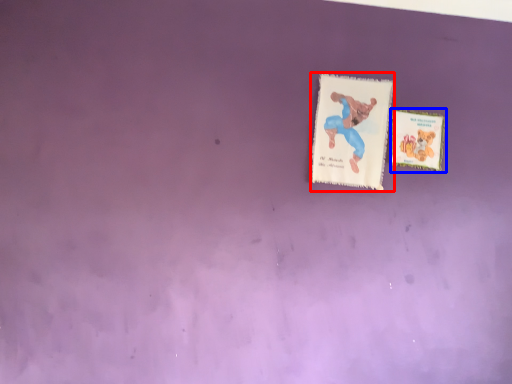
Question: Among these objects, which one is farthest to the camera, card (highlighted by a red box) or card (highlighted by a blue box)?

Choices:
 (A) card
 (B) card

Answer: (B)